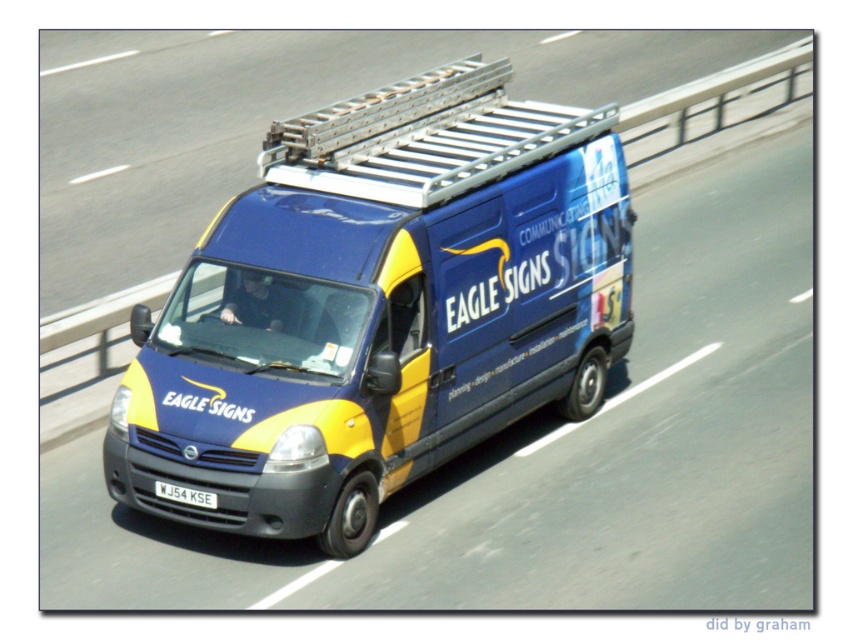
In the scene shown: Is blue matte van at center shorter than white plastic license plate at center?

Incorrect, blue matte van at center's height does not fall short of white plastic license plate at center's.

Which is in front, point (283, 195) or point (200, 506)?

Point (200, 506) is more forward.

Locate an element on the screen. blue matte van at center is located at coordinates (379, 307).